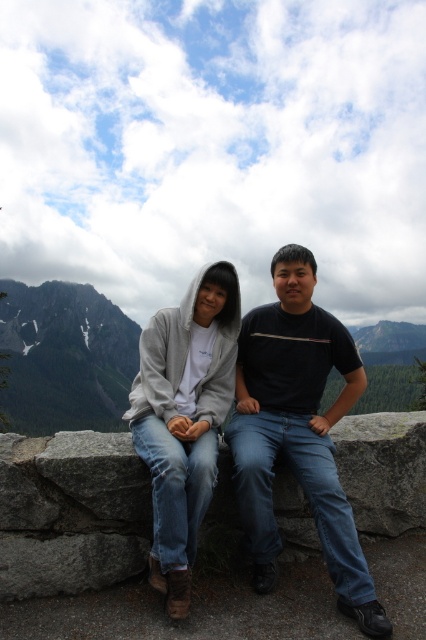
Looking at this image, you are a photographer trying to capture both the black matte shirt at center and the matte gray hoodie at center in a single frame. Which clothing item should you adjust your focus on to ensure both are in frame without cropping?

Since the black matte shirt at center is wider than the matte gray hoodie at center, you should focus on the black matte shirt at center to ensure the entire width of both items fits within the frame.

Based on the photo, you are an artist trying to sketch the scene. You want to ensure the black matte shirt at center and the gray rocky mountain at left are proportionally accurate. Which object should you draw smaller to maintain the correct scale?

The black matte shirt at center should be drawn smaller than the gray rocky mountain at left since it occupies less space in the image.

You are a photographer trying to capture both the black matte shirt at center and the matte gray hoodie at center in a single frame. Based on their sizes, which one would appear closer to the camera?

The black matte shirt at center appears larger than the matte gray hoodie at center, so it would be closer to the camera.